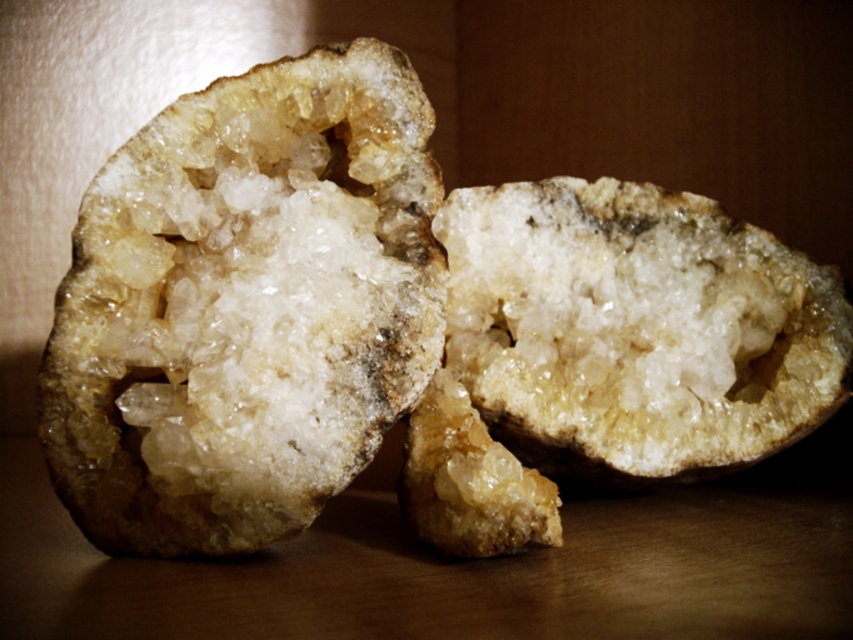
Question: Does translucent crystal rock at center appear under translucent crystal at center?

Choices:
 (A) no
 (B) yes

Answer: (A)

Question: Among these points, which one is farthest from the camera?

Choices:
 (A) (299, 296)
 (B) (659, 312)

Answer: (B)

Question: Can you confirm if translucent crystal rock at center is bigger than translucent crystal at center?

Choices:
 (A) no
 (B) yes

Answer: (B)

Question: Observing the image, what is the correct spatial positioning of translucent crystal rock at center in reference to translucent crystal at center?

Choices:
 (A) below
 (B) above

Answer: (B)

Question: Which point is closer to the camera?

Choices:
 (A) (474, 400)
 (B) (149, 481)

Answer: (B)

Question: Among these points, which one is farthest from the camera?

Choices:
 (A) (331, 154)
 (B) (538, 316)

Answer: (B)